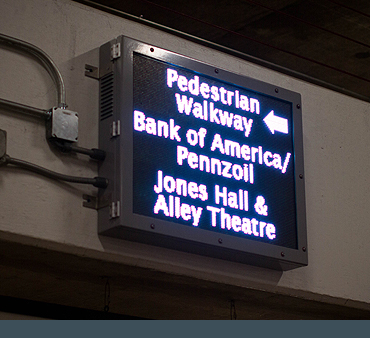
Find the location of `wall`. wall is located at coordinates (68, 31), (343, 240).